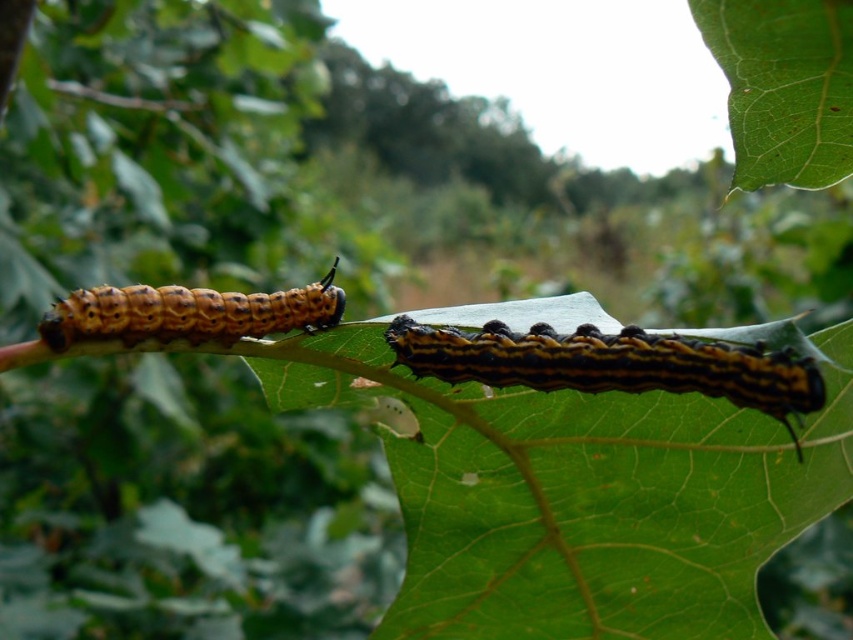
You are an entomologist observing two caterpillars on a leaf. You notice a point at coordinates (613,364). What is the creature located at that point?

The creature located at point (613,364) is a brown fuzzy caterpillar at center.

You are a photographer holding a camera at a height of 5 feet. You want to capture a close shot of the caterpillar located at point [677,340] in the image. Will the caterpillar be in focus if your camera has a depth of field that can only focus on objects within 4 feet from the lens?

The distance between the camera and point [677,340] is 4.65 feet. Since the depth of field can only focus within 4 feet, the caterpillar will not be in focus.

Looking at this image, you are a nature photographer trying to capture both brown fuzzy caterpillar at center and brown fuzzy caterpillar at left in a single frame. Since you want to highlight their size difference, which caterpillar should you focus on first to ensure it appears larger in your photo?

The brown fuzzy caterpillar at center is larger in size than the brown fuzzy caterpillar at left, so you should focus on the brown fuzzy caterpillar at center first to emphasize its larger size in the photo.